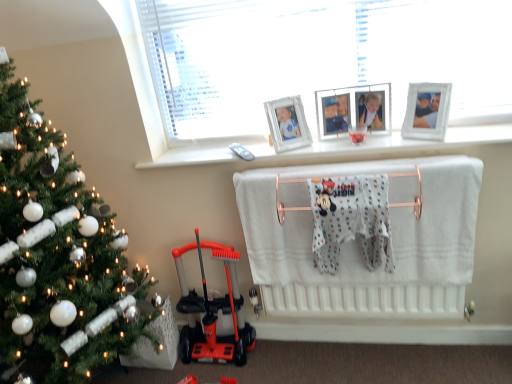
Question: Is white glass window at upper center beside white glossy picture frame at upper right, which appears as the first picture frame when viewed from the right?

Choices:
 (A) yes
 (B) no

Answer: (B)

Question: Can white glossy picture frame at upper right, which appears as the first picture frame when viewed from the right, be found inside white glass window at upper center?

Choices:
 (A) yes
 (B) no

Answer: (A)

Question: Is white glass window at upper center looking in the opposite direction of white glossy picture frame at upper right, which ranks as the 2th picture frame in left-to-right order?

Choices:
 (A) no
 (B) yes

Answer: (B)

Question: Does white glass window at upper center have a greater width compared to white glossy picture frame at upper right, which appears as the first picture frame when viewed from the right?

Choices:
 (A) yes
 (B) no

Answer: (A)

Question: Is white glass window at upper center further to the viewer compared to white glossy picture frame at upper right, which appears as the first picture frame when viewed from the right?

Choices:
 (A) yes
 (B) no

Answer: (B)

Question: Is white glass window at upper center to the right of white glossy picture frame at upper right, which ranks as the 2th picture frame in left-to-right order, from the viewer's perspective?

Choices:
 (A) yes
 (B) no

Answer: (B)

Question: Is orange plastic scooter at lower left bigger than white fabric infant bed at center?

Choices:
 (A) no
 (B) yes

Answer: (A)

Question: Is orange plastic scooter at lower left to the left of white fabric infant bed at center from the viewer's perspective?

Choices:
 (A) yes
 (B) no

Answer: (A)

Question: From a real-world perspective, is orange plastic scooter at lower left physically above white fabric infant bed at center?

Choices:
 (A) no
 (B) yes

Answer: (A)

Question: Is orange plastic scooter at lower left thinner than white fabric infant bed at center?

Choices:
 (A) yes
 (B) no

Answer: (B)

Question: Considering the relative sizes of orange plastic scooter at lower left and white fabric infant bed at center in the image provided, is orange plastic scooter at lower left taller than white fabric infant bed at center?

Choices:
 (A) yes
 (B) no

Answer: (B)

Question: Is white fabric infant bed at center at the back of orange plastic scooter at lower left?

Choices:
 (A) no
 (B) yes

Answer: (A)

Question: From the image's perspective, is green matte christmas tree at left located above white glass window at upper center?

Choices:
 (A) yes
 (B) no

Answer: (B)